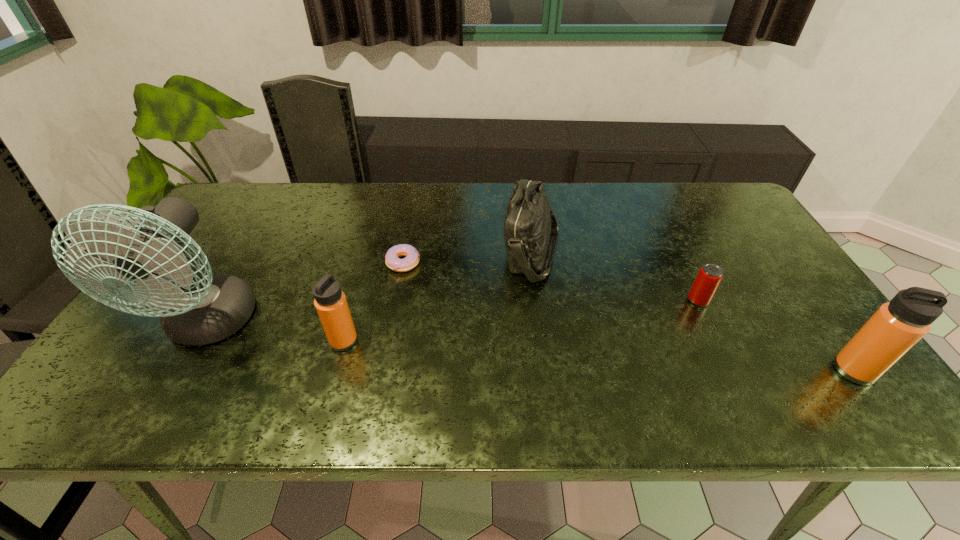
I want to click on the shorter thermos bottle, so click(330, 302).

Find the location of a particular element. the left thermos bottle is located at coordinates (330, 302).

The width and height of the screenshot is (960, 540). What are the coordinates of `the rightmost object` in the screenshot? It's located at (898, 325).

This screenshot has height=540, width=960. What are the coordinates of `the nearer thermos bottle` in the screenshot? It's located at (898, 325).

The image size is (960, 540). What are the coordinates of `the fourth object from left to right` in the screenshot? It's located at (530, 228).

Where is `doughnut`? doughnut is located at coordinates (412, 257).

Locate an element on the screen. This screenshot has width=960, height=540. the third object from left to right is located at coordinates (412, 257).

This screenshot has width=960, height=540. Identify the location of the fifth tallest object. (708, 279).

Image resolution: width=960 pixels, height=540 pixels. I want to click on beer can, so click(708, 279).

This screenshot has width=960, height=540. Find the location of `the tallest object`. the tallest object is located at coordinates (202, 309).